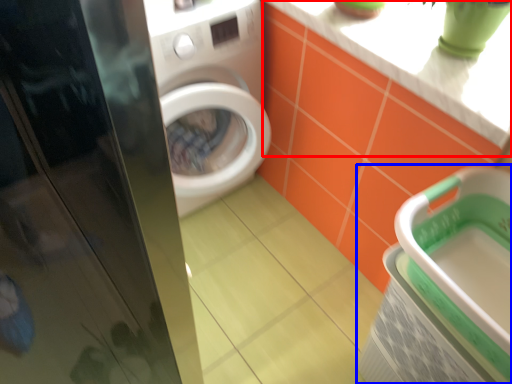
Question: Which object appears farthest to the camera in this image, counter top (highlighted by a red box) or dish washer (highlighted by a blue box)?

Choices:
 (A) counter top
 (B) dish washer

Answer: (A)